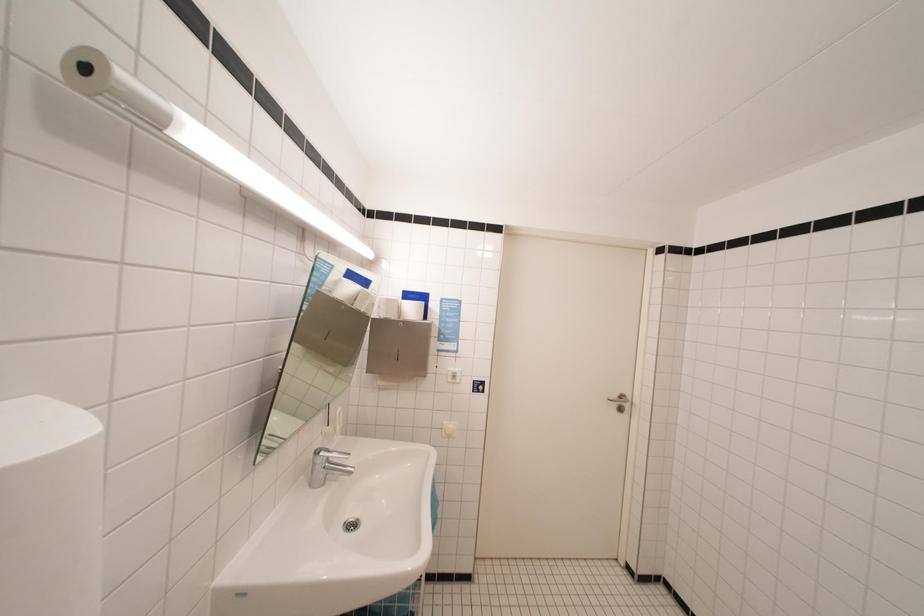
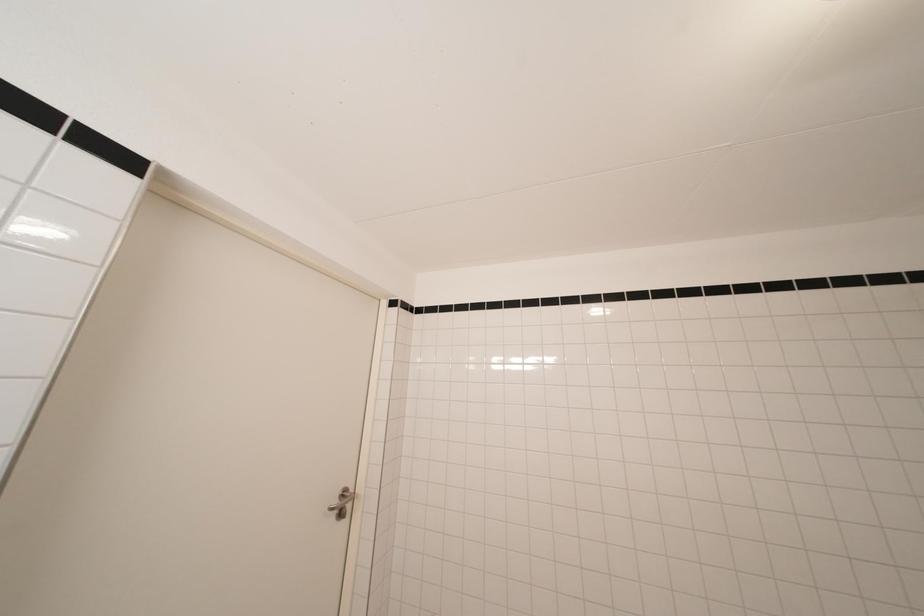
Question: The camera is either moving clockwise (left) or counter-clockwise (right) around the object. The first image is from the beginning of the video and the second image is from the end. Is the camera moving left or right when shooting the video?

Choices:
 (A) Left
 (B) Right

Answer: (A)